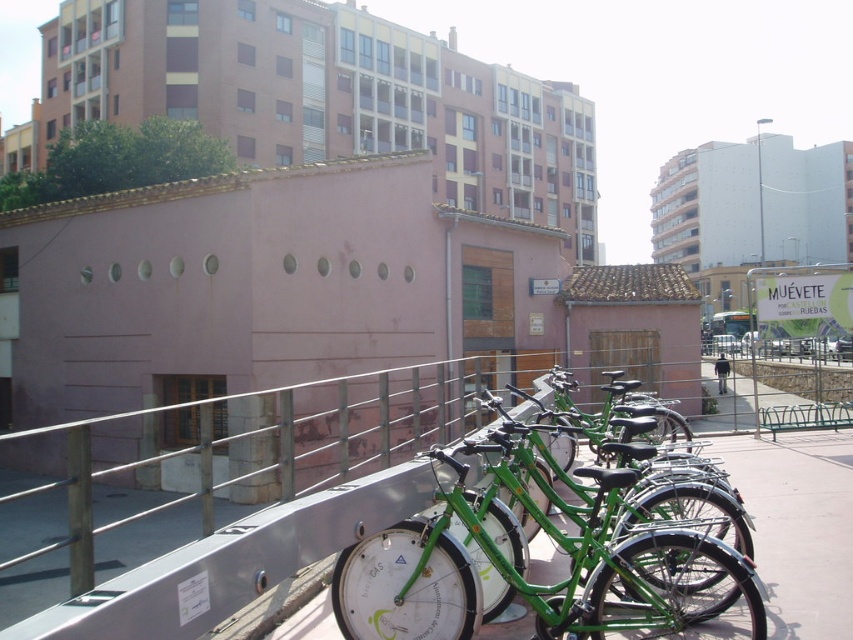
Question: Can you confirm if green matte bicycle at center is positioned above black fabric jacket at center?

Choices:
 (A) yes
 (B) no

Answer: (A)

Question: Which of the following is the closest to the observer?

Choices:
 (A) black fabric jacket at center
 (B) green matte bicycle at center

Answer: (B)

Question: Which point is farther to the camera?

Choices:
 (A) green matte bicycle at center
 (B) black fabric jacket at center

Answer: (B)

Question: Does green matte bicycle at center have a larger size compared to black fabric jacket at center?

Choices:
 (A) no
 (B) yes

Answer: (A)

Question: Does green matte bicycle at center appear on the left side of black fabric jacket at center?

Choices:
 (A) no
 (B) yes

Answer: (B)